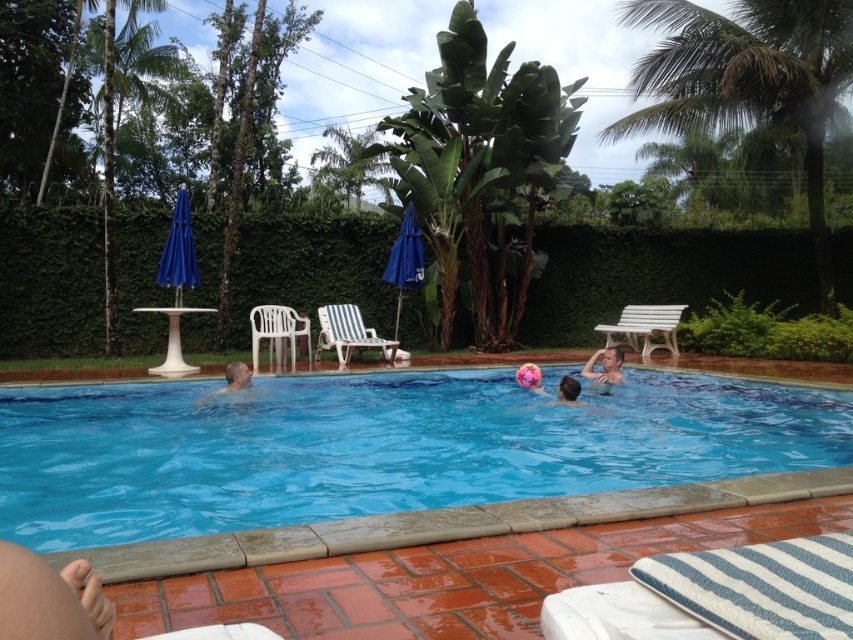
Question: In this image, where is smooth skin person at upper right located relative to smooth pink ball at center?

Choices:
 (A) above
 (B) below

Answer: (A)

Question: In this image, where is white striped plastic chair at center located relative to smooth skin person at upper right?

Choices:
 (A) right
 (B) left

Answer: (B)

Question: Which object is closer to the camera taking this photo?

Choices:
 (A) smooth skin man at center
 (B) white plastic chair at upper left
 (C) white wooden bench at upper right
 (D) blue glossy water at center

Answer: (D)

Question: Based on their relative distances, which object is farther from the smooth skin man at center?

Choices:
 (A) smooth pink ball at center
 (B) white striped plastic chair at center
 (C) smooth skin person at upper right
 (D) green leafy hedge at upper center

Answer: (D)

Question: Considering the relative positions of blue glossy water at center and green leafy hedge at upper center in the image provided, where is blue glossy water at center located with respect to green leafy hedge at upper center?

Choices:
 (A) left
 (B) right

Answer: (A)

Question: Which of these objects is positioned farthest from the smooth skin man at center?

Choices:
 (A) blue glossy water at center
 (B) white striped plastic chair at center

Answer: (B)